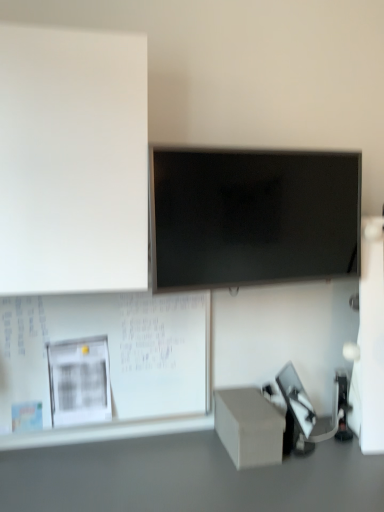
The height and width of the screenshot is (512, 384). In order to click on vacant space to the left of matte gray cube at lower right in this screenshot , I will do `click(193, 449)`.